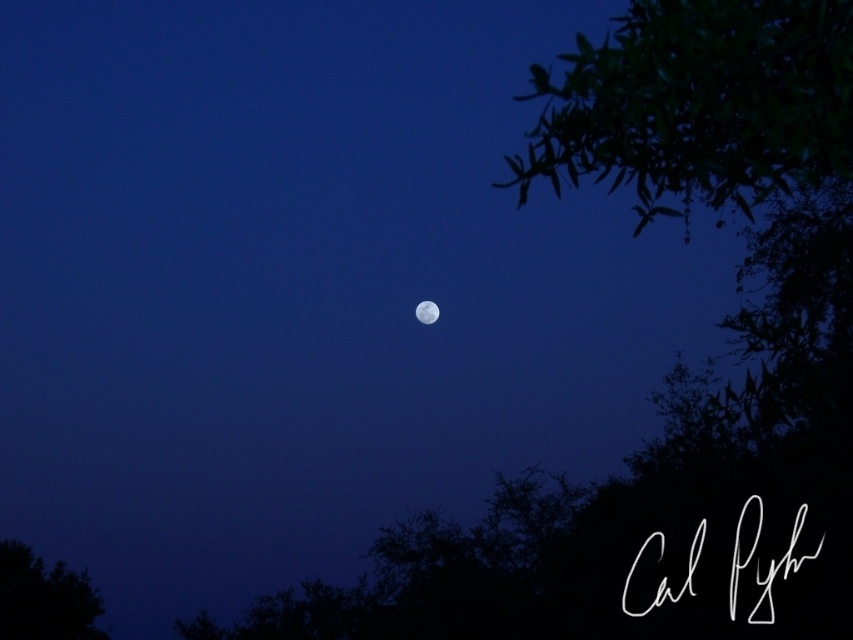
Question: Which is nearer to the white reflective moon at center?

Choices:
 (A) green leafy branches at upper right
 (B) green leafy tree at lower left

Answer: (B)

Question: Is green leafy tree at lower left to the right of white reflective moon at center from the viewer's perspective?

Choices:
 (A) yes
 (B) no

Answer: (B)

Question: Among these points, which one is nearest to the camera?

Choices:
 (A) (432, 316)
 (B) (73, 593)

Answer: (A)

Question: Which of the following is the closest to the observer?

Choices:
 (A) green leafy tree at lower left
 (B) white reflective moon at center

Answer: (B)

Question: Is green leafy tree at lower left behind white reflective moon at center?

Choices:
 (A) yes
 (B) no

Answer: (A)

Question: Is the position of green leafy tree at lower left less distant than that of white reflective moon at center?

Choices:
 (A) no
 (B) yes

Answer: (A)